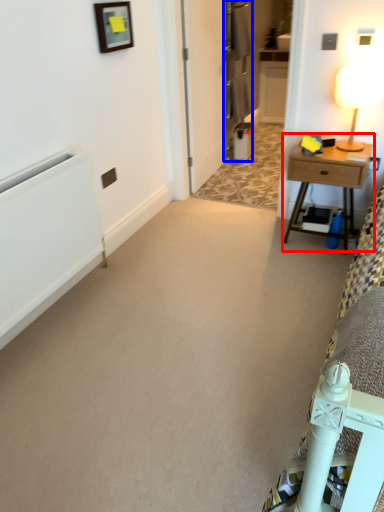
Question: Which object appears closest to the camera in this image, nightstand (highlighted by a red box) or armoire (highlighted by a blue box)?

Choices:
 (A) nightstand
 (B) armoire

Answer: (A)